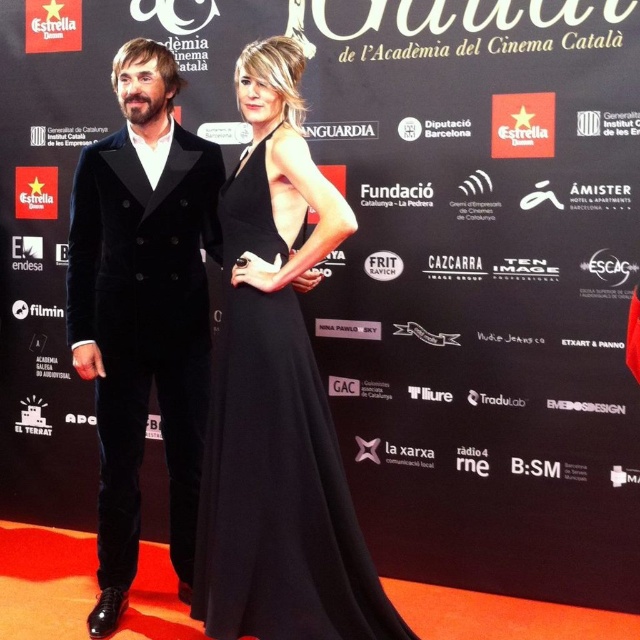
Is velvet black suit at left bigger than black satin dress at center?

Indeed, velvet black suit at left has a larger size compared to black satin dress at center.

Is point (83, 307) less distant than point (348, 492)?

No, it is not.

What are the coordinates of `velvet black suit at left` in the screenshot? It's located at (144, 310).